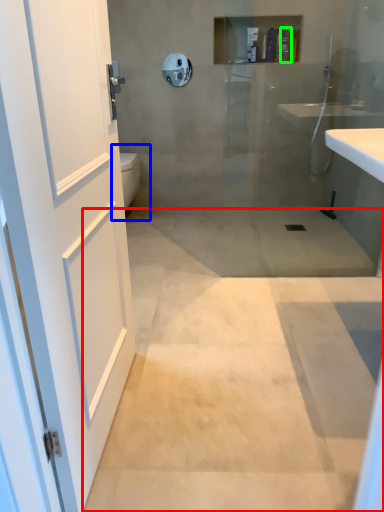
Question: Based on their relative distances, which object is farther from concrete (highlighted by a red box)? Choose from toilet bowl (highlighted by a blue box) and toiletry (highlighted by a green box).

Choices:
 (A) toilet bowl
 (B) toiletry

Answer: (B)